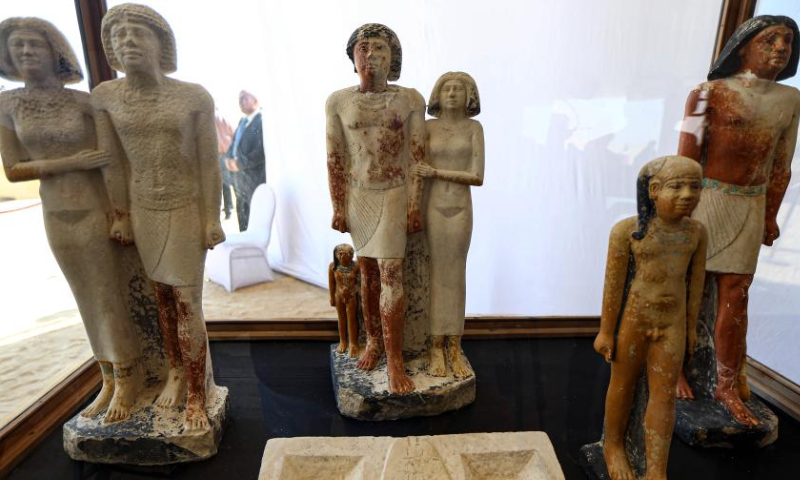
Locate an element on the screen. This screenshot has height=480, width=800. wooden edge of case base , lower left corner is located at coordinates (20, 430), (58, 396), (85, 366).